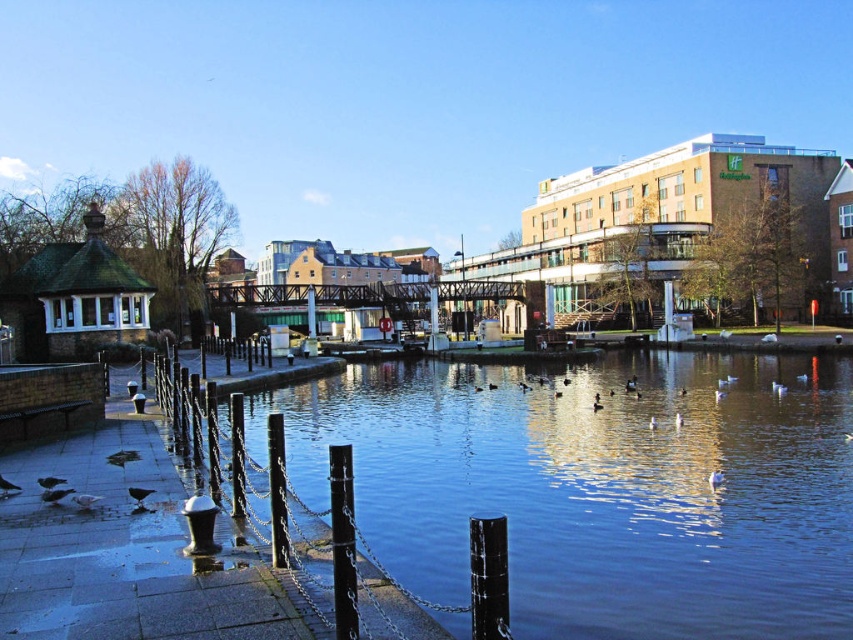
Question: Where is blue water at center located in relation to black metal pole at lower center in the image?

Choices:
 (A) right
 (B) left

Answer: (A)

Question: Does blue water at center come behind black metal pole at lower center?

Choices:
 (A) yes
 (B) no

Answer: (A)

Question: Among these objects, which one is nearest to the camera?

Choices:
 (A) black metal pole at lower center
 (B) blue water at center

Answer: (A)

Question: Which point appears closest to the camera in this image?

Choices:
 (A) (346, 572)
 (B) (723, 378)

Answer: (A)

Question: Is the position of blue water at center less distant than that of black metal pole at lower center?

Choices:
 (A) yes
 (B) no

Answer: (B)

Question: Which point is farther to the camera?

Choices:
 (A) (341, 568)
 (B) (698, 474)

Answer: (B)